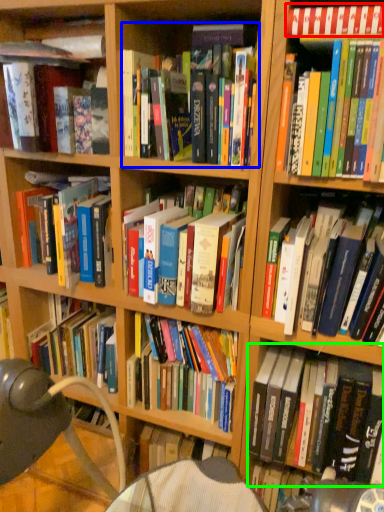
Question: Estimate the real-world distances between objects in this image. Which object is farther from book (highlighted by a red box), book (highlighted by a blue box) or book (highlighted by a green box)?

Choices:
 (A) book
 (B) book

Answer: (B)